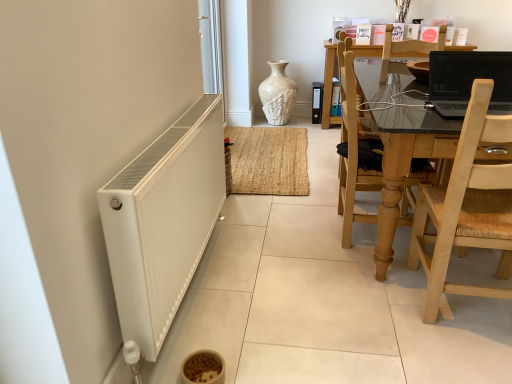
You are a GUI agent. You are given a task and a screenshot of the screen. Output one action in this format:
    pyautogui.click(x=<x>, y=<y>)
    Task: Click on the vacant space positioned to the left of wooden chair at right, which is the second chair in front-to-back order
    This screenshot has height=384, width=512.
    Given the screenshot: What is the action you would take?
    pyautogui.click(x=297, y=230)